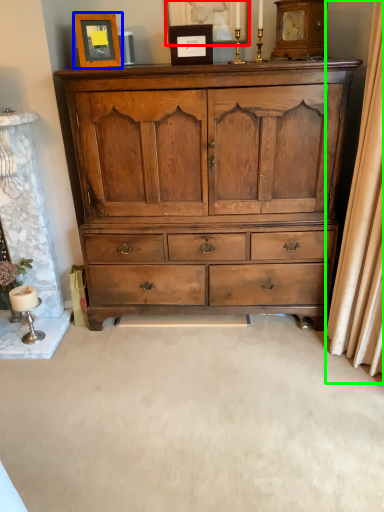
Question: Estimate the real-world distances between objects in this image. Which object is farther from picture frame (highlighted by a red box), picture frame (highlighted by a blue box) or curtain (highlighted by a green box)?

Choices:
 (A) picture frame
 (B) curtain

Answer: (B)